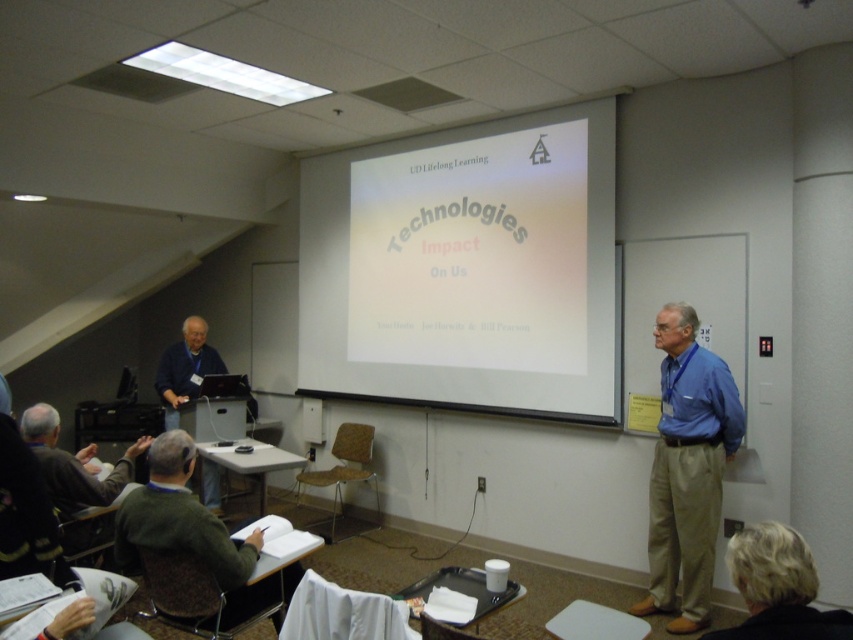
You are a student sitting in the classroom and want to take a photo of the white glossy projector screen at center and the matte blue shirt at left for your notes. Which object should you focus on first if you want to capture both in one shot without moving your camera?

The white glossy projector screen at center is positioned on the right side of the matte blue shirt at left, so you should focus on the matte blue shirt at left first to ensure both are in frame.

You are a photographer in the classroom and want to capture a photo of the blue cotton shirt at right and the green fabric chair at lower left. If the camera can only focus on objects within a 3 meter distance, will both objects be in focus?

The blue cotton shirt at right is bigger than green fabric chair at lower left, but the question of focus distance depends on their actual positions, not their sizes. Since the camera can focus on objects within 3 meters, both objects would be in focus if they are within that range. However, the description does not provide their exact distances from the camera, so we cannot confirm based on the given information.